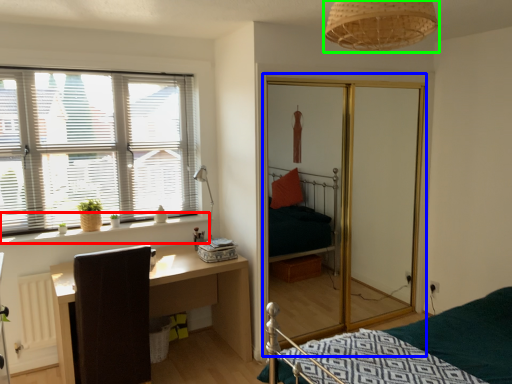
Question: Which is nearer to the window sill (highlighted by a red box)? screen door (highlighted by a blue box) or light fixture (highlighted by a green box).

Choices:
 (A) screen door
 (B) light fixture

Answer: (A)